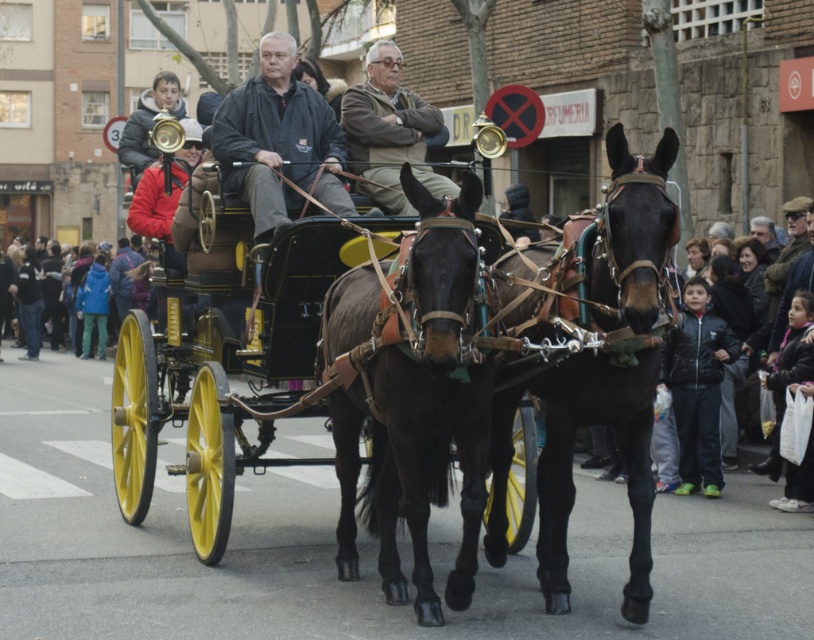
You are a photographer standing on the sidewalk observing the black leather horse at center and the dark gray jacket at center. Which object would appear larger in your camera viewfinder?

The black leather horse at center would appear larger in the camera viewfinder because it is much taller than the dark gray jacket at center.